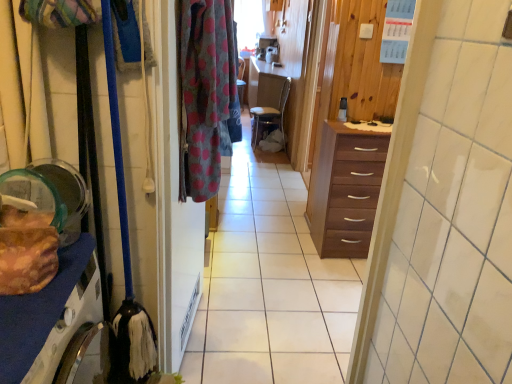
The image size is (512, 384). What are the coordinates of `vacant space in front of dark brown wood drawer at center, positioned as the first cabinetry in back-to-front order` in the screenshot? It's located at (335, 275).